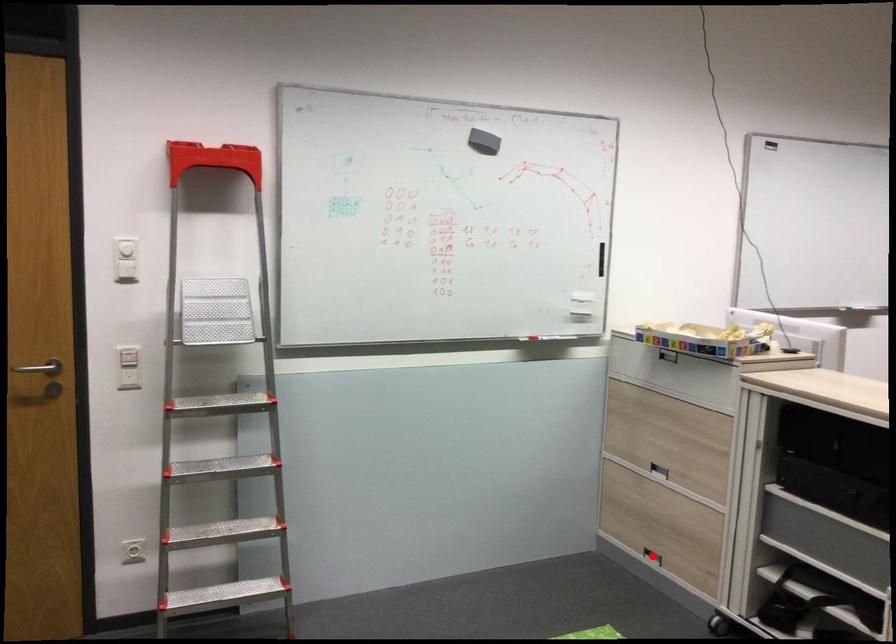
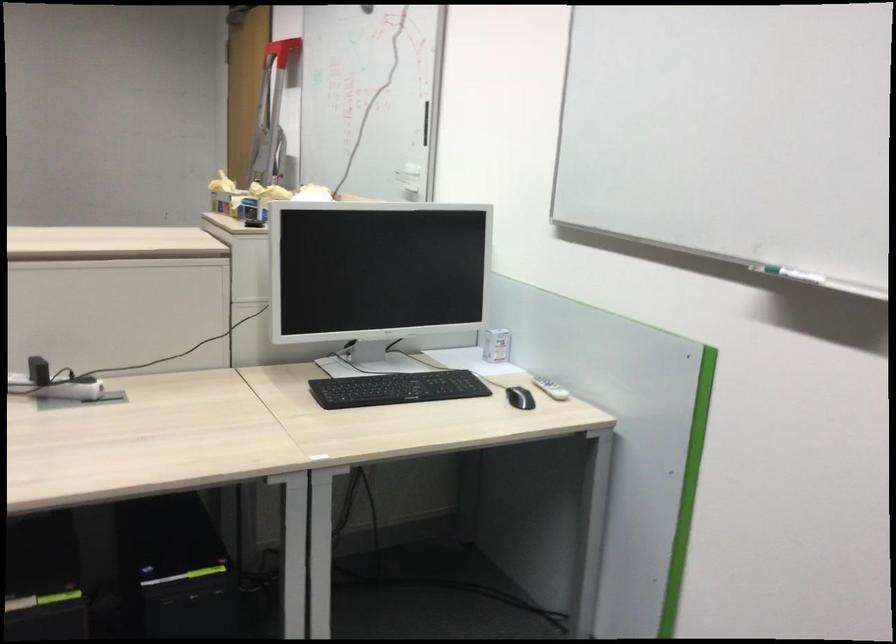
Question: I am providing you with two images of the same scene from different viewpoints. A red point is marked on the first image. Is the red point's position out of view in image 2?

Choices:
 (A) Yes
 (B) No

Answer: (A)